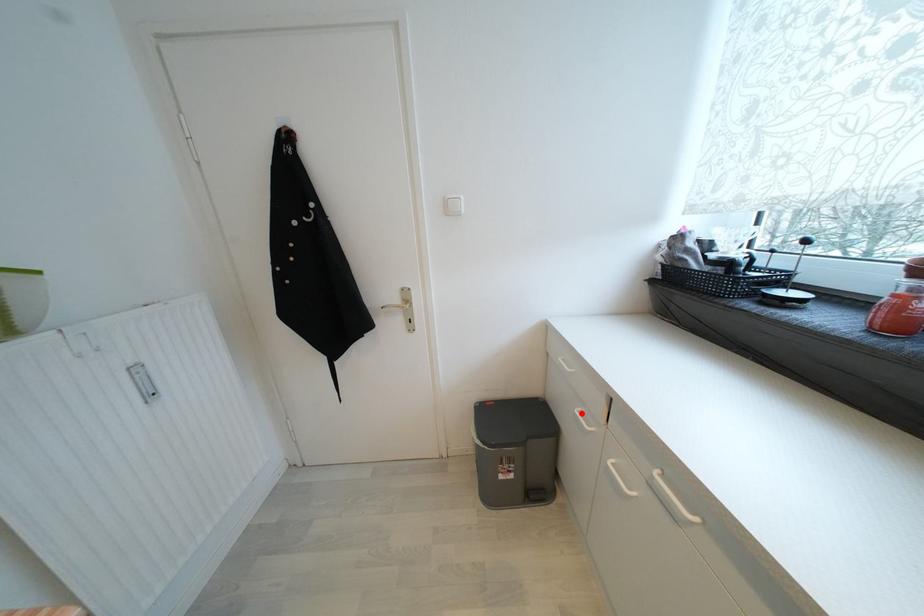
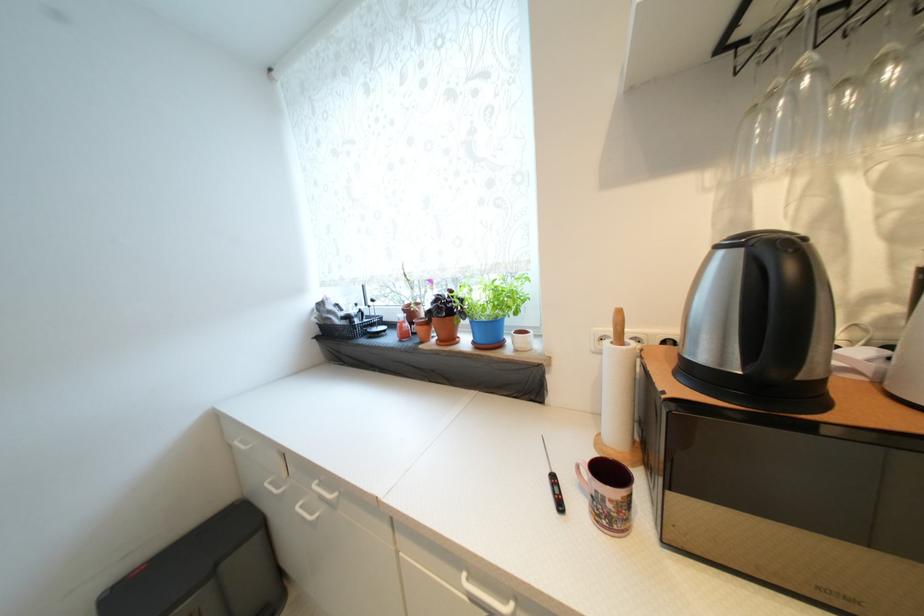
Question: I am providing you with two images of the same scene from different viewpoints. A red point is marked on the first image. Can you still see the location of the red point in image 2?

Choices:
 (A) Yes
 (B) No

Answer: (A)